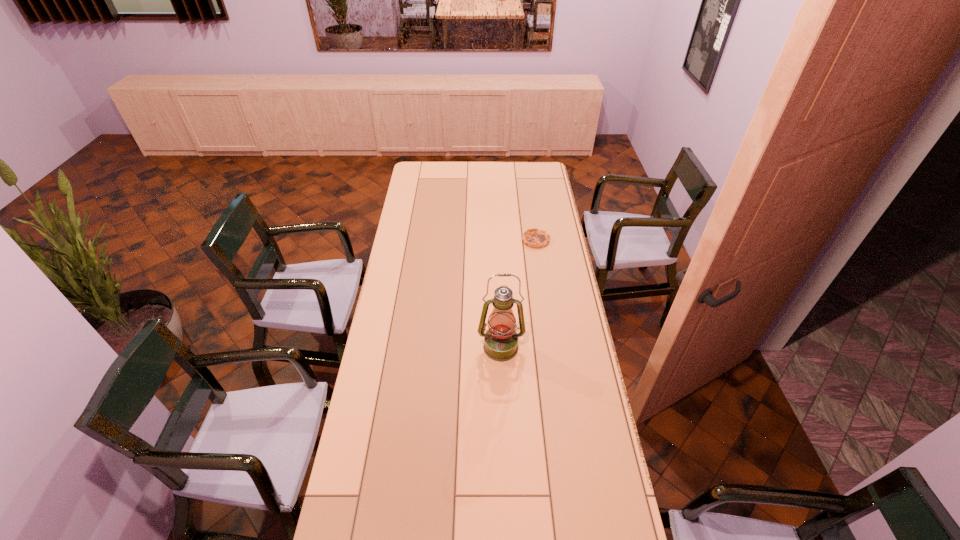
This screenshot has width=960, height=540. In the image, there is a desktop. Identify the location of vacant area at the far left corner. (416, 167).

Identify the location of free space that satisfies the following two spatial constraints: 1. on the back side of the quiche; 2. on the left side of the oil lamp. Image resolution: width=960 pixels, height=540 pixels. (496, 240).

Where is `free location that satisfies the following two spatial constraints: 1. on the back side of the nearer object; 2. on the right side of the shorter object`? free location that satisfies the following two spatial constraints: 1. on the back side of the nearer object; 2. on the right side of the shorter object is located at coordinates (496, 240).

What are the coordinates of `vacant position in the image that satisfies the following two spatial constraints: 1. on the back side of the taller object; 2. on the left side of the quiche` in the screenshot? It's located at (496, 240).

At what (x,y) coordinates should I click in order to perform the action: click on free spot that satisfies the following two spatial constraints: 1. on the back side of the quiche; 2. on the left side of the left object. Please return your answer as a coordinate pair (x, y). The image size is (960, 540). Looking at the image, I should click on (496, 240).